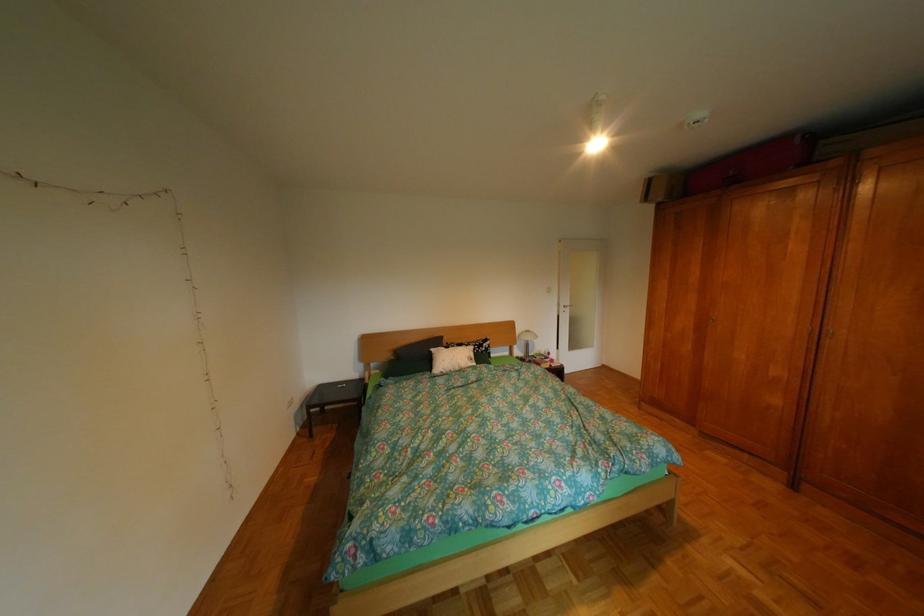
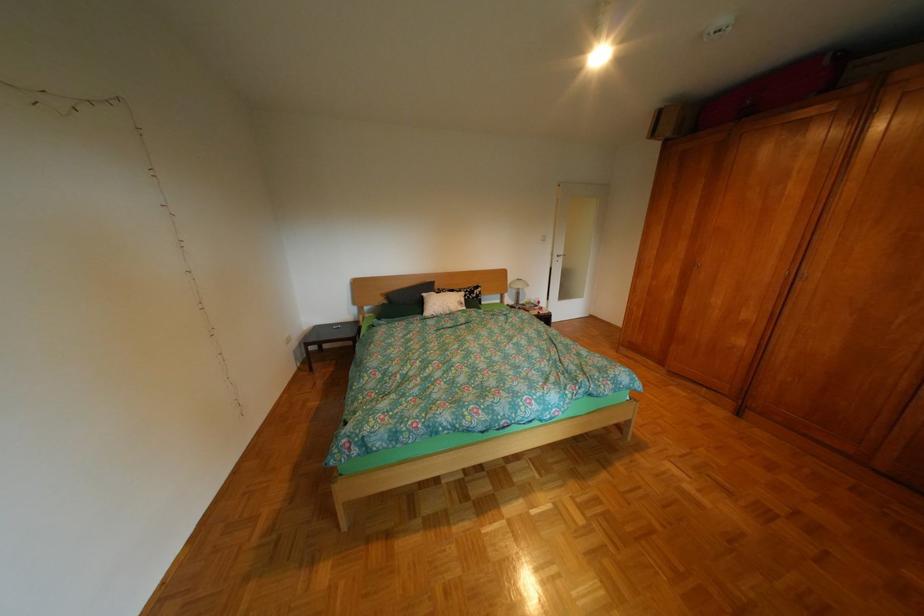
In the second image, find the point that corresponds to pixel 407 359 in the first image.

(400, 302)